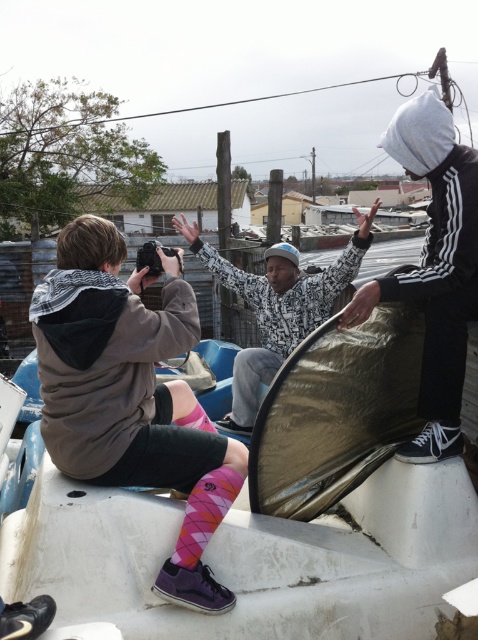
You are a GUI agent. You are given a task and a screenshot of the screen. Output one action in this format:
    pyautogui.click(x=<x>, y=<y>)
    Task: Click on the pink argyle socks at lower left
    This screenshot has height=640, width=478.
    Given the screenshot: What is the action you would take?
    pyautogui.click(x=130, y=396)

Measure the distance between pink argyle socks at lower left and white textured jacket at center.

They are 1.34 meters apart.

Image resolution: width=478 pixels, height=640 pixels. Find the location of `pink argyle socks at lower left`. pink argyle socks at lower left is located at coordinates (130, 396).

From the picture: Which of these two, white textured jacket at center or pink diamond-patterned sock at lower center, stands taller?

white textured jacket at center

What do you see at coordinates (278, 307) in the screenshot? This screenshot has height=640, width=478. I see `white textured jacket at center` at bounding box center [278, 307].

At what (x,y) coordinates should I click in order to perform the action: click on white textured jacket at center. Please return your answer as a coordinate pair (x, y). Image resolution: width=478 pixels, height=640 pixels. Looking at the image, I should click on (278, 307).

Can you confirm if white hoodie at upper right is shorter than pink diamond-patterned sock at lower center?

No, white hoodie at upper right is not shorter than pink diamond-patterned sock at lower center.

Can you confirm if white hoodie at upper right is bigger than pink diamond-patterned sock at lower center?

Yes.

The width and height of the screenshot is (478, 640). Identify the location of white hoodie at upper right. (434, 269).